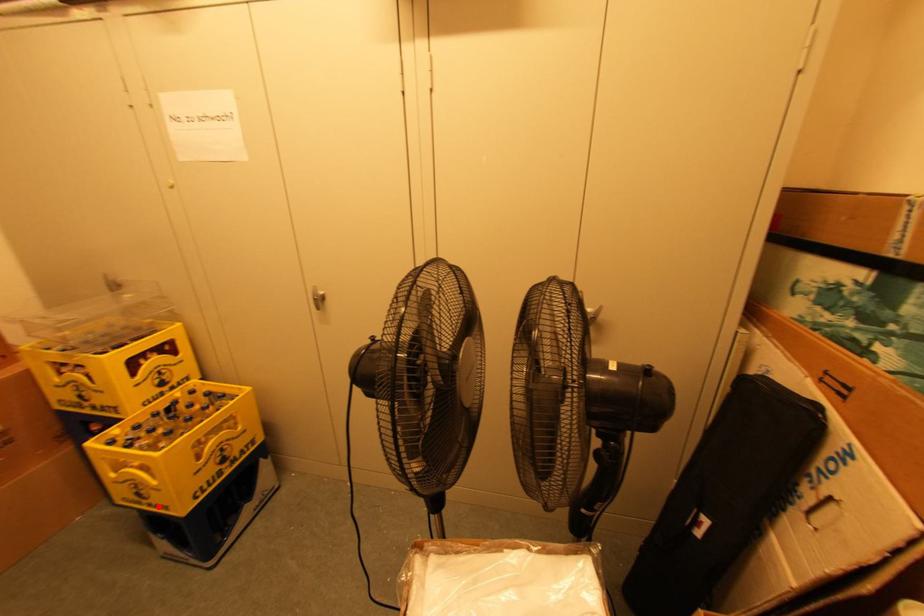
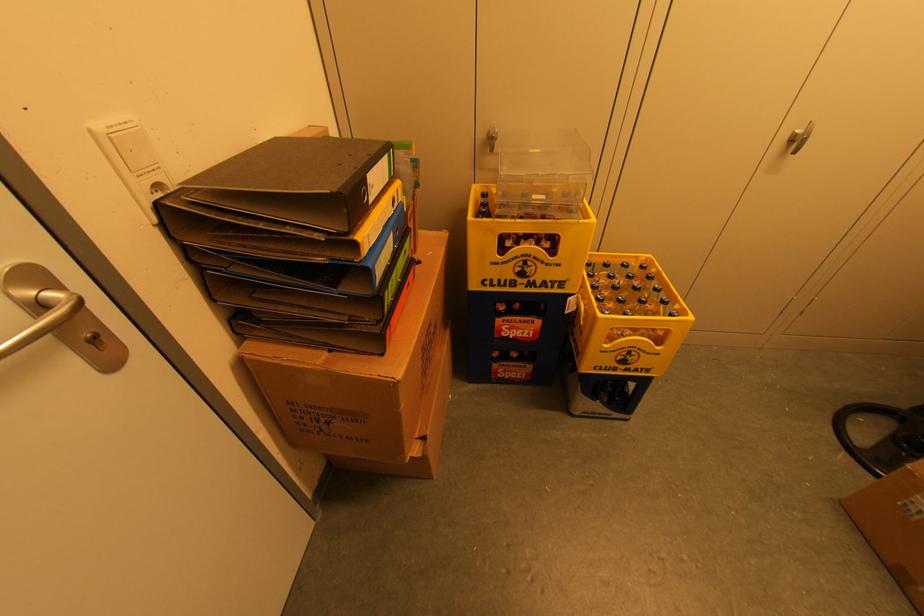
Question: I am providing you with two images of the same scene from different viewpoints. Given a red point in image1, look at the same physical point in image2. Is it:

Choices:
 (A) Closer to the viewpoint
 (B) Farther from the viewpoint

Answer: (B)